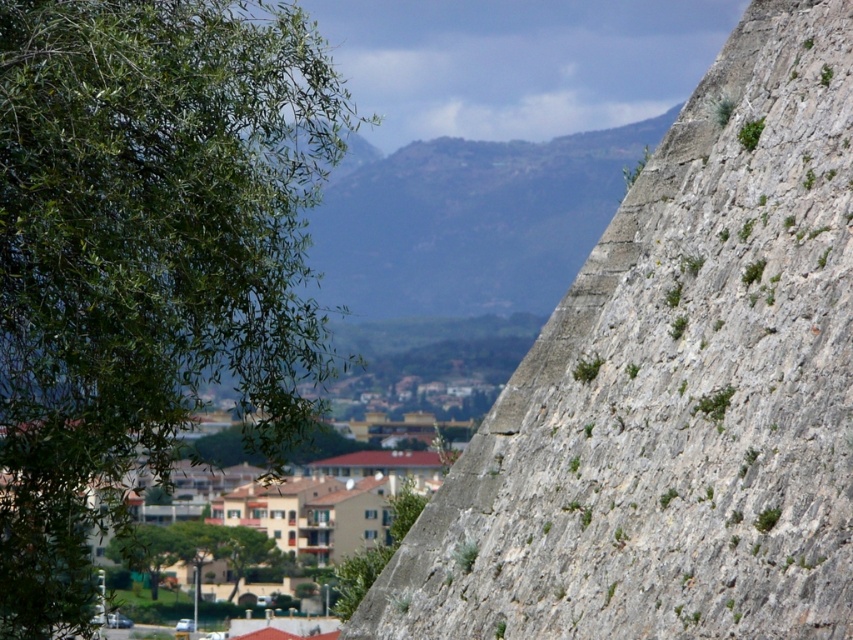
Question: Which object is positioned farthest from the green leafy tree at lower center?

Choices:
 (A) green leafy tree at left
 (B) gray rough stone wall at right

Answer: (B)

Question: Which object is positioned closest to the gray rough stone wall at right?

Choices:
 (A) green leafy tree at lower center
 (B) green leafy tree at left

Answer: (B)

Question: Is gray rough stone wall at right positioned before green leafy tree at lower center?

Choices:
 (A) yes
 (B) no

Answer: (A)

Question: Is gray rough stone wall at right thinner than green leafy tree at left?

Choices:
 (A) yes
 (B) no

Answer: (A)

Question: Which point is closer to the camera?

Choices:
 (A) (245, 556)
 (B) (171, 188)
 (C) (650, 227)

Answer: (C)

Question: Can you confirm if gray rough stone wall at right is positioned above green leafy tree at lower center?

Choices:
 (A) no
 (B) yes

Answer: (B)